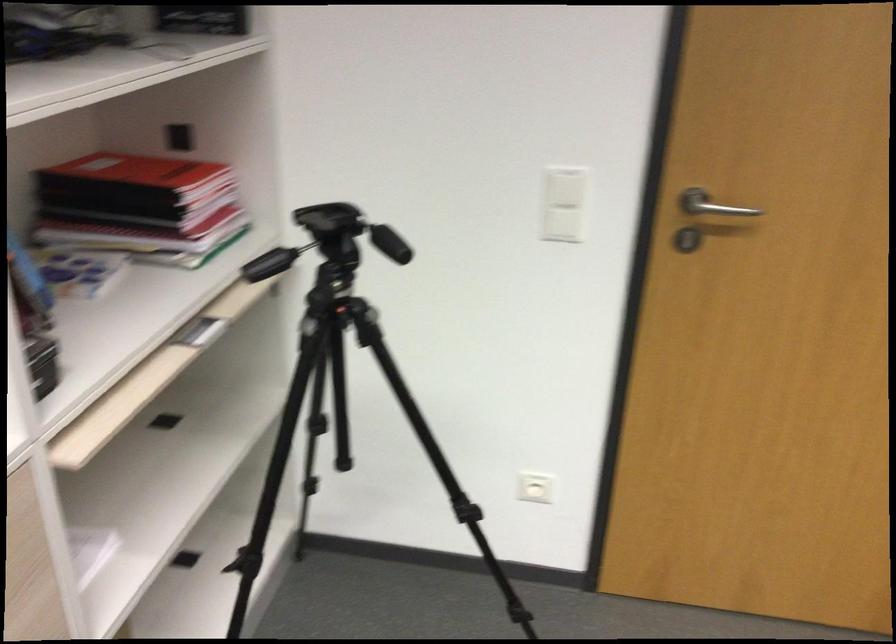
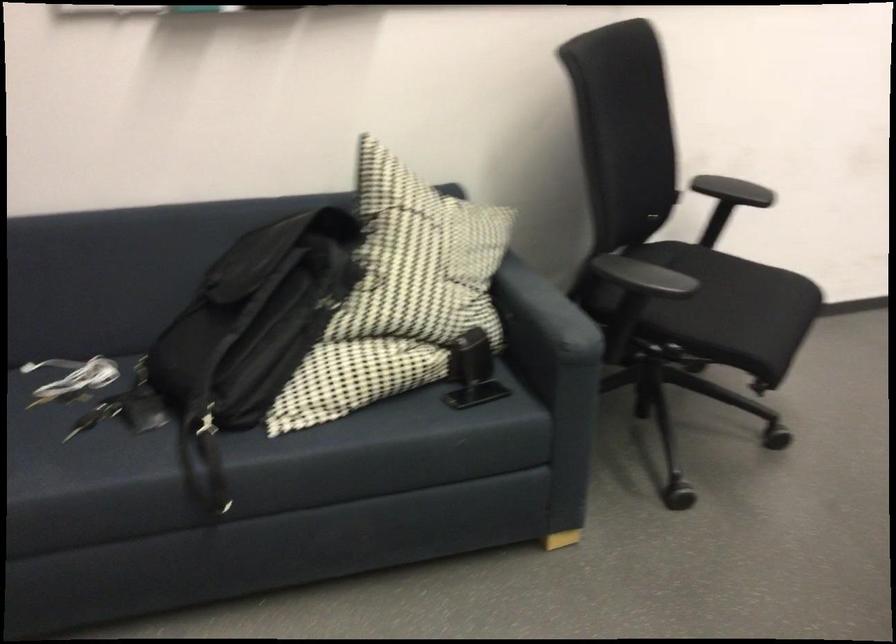
First-person continuous shooting, in which direction is the camera rotating?

The camera rotated toward right-down.